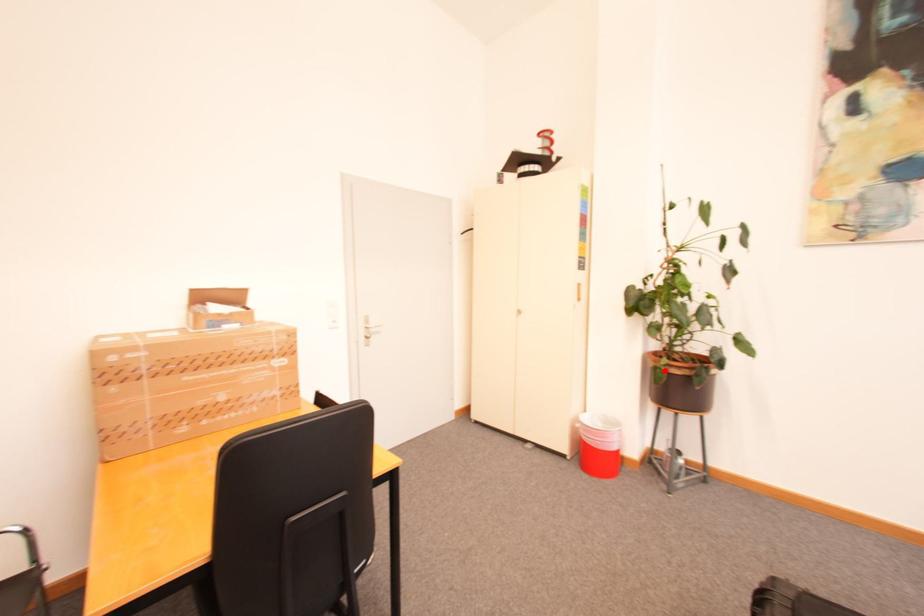
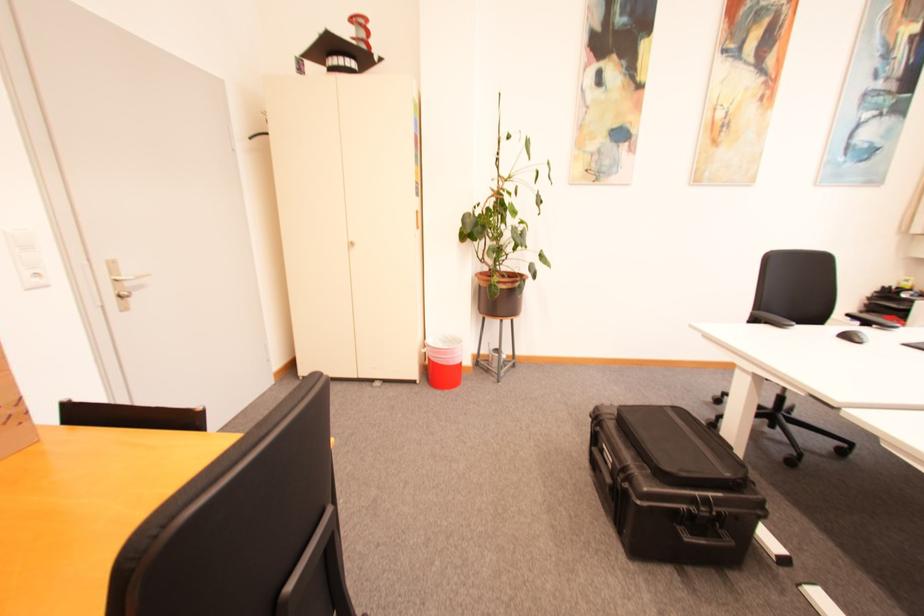
The point at the highlighted location is marked in the first image. Where is the corresponding point in the second image?

(500, 286)